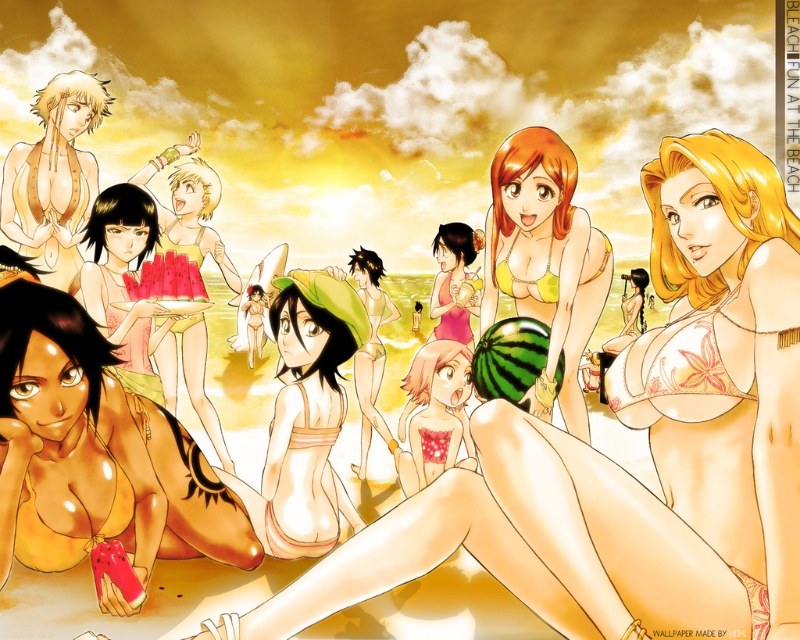
In the scene shown: How far apart are matte pink bikini at center and matte green bikini at center?

A distance of 6.39 feet exists between matte pink bikini at center and matte green bikini at center.

Does matte pink bikini at center have a greater width compared to matte green bikini at center?

Indeed, matte pink bikini at center has a greater width compared to matte green bikini at center.

Which is in front, point (192, 353) or point (372, 305)?

Positioned in front is point (192, 353).

Where is `matte pink bikini at center`? The height and width of the screenshot is (640, 800). matte pink bikini at center is located at coordinates (194, 218).

Between yellow-green bikini at center and matte pink bikini at center, which one appears on the left side from the viewer's perspective?

Positioned to the left is matte pink bikini at center.

The width and height of the screenshot is (800, 640). Describe the element at coordinates (545, 260) in the screenshot. I see `yellow-green bikini at center` at that location.

Which is behind, point (521, 230) or point (212, 404)?

Point (212, 404)

Where is `yellow-green bikini at center`? The height and width of the screenshot is (640, 800). yellow-green bikini at center is located at coordinates (545, 260).

Does yellow-green bikini at center have a smaller size compared to matte yellow bikini at left?

Indeed, yellow-green bikini at center has a smaller size compared to matte yellow bikini at left.

Does yellow-green bikini at center appear on the right side of matte yellow bikini at left?

Indeed, yellow-green bikini at center is positioned on the right side of matte yellow bikini at left.

In the scene shown: Who is more distant from viewer, (590, 323) or (49, 147)?

The point (49, 147) is more distant.

Identify the location of yellow-green bikini at center. This screenshot has width=800, height=640. (545, 260).